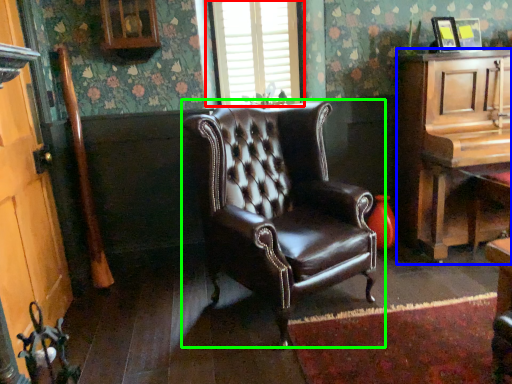
Question: Which object is the farthest from window (highlighted by a red box)? Choose among these: cabinetry (highlighted by a blue box) or chair (highlighted by a green box).

Choices:
 (A) cabinetry
 (B) chair

Answer: (A)